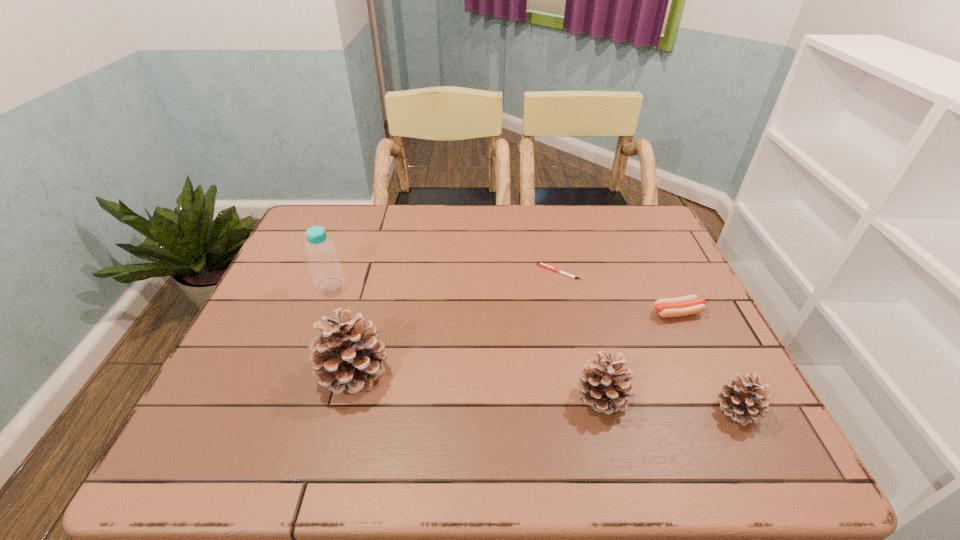
The image size is (960, 540). Identify the location of vacant space that's between the leftmost pinecone and the fourth shortest object. (478, 384).

Where is `blank region between the third shortest object and the third farthest object`? blank region between the third shortest object and the third farthest object is located at coordinates (707, 361).

Where is `free space between the bottle and the second pinecone from right to left`? Image resolution: width=960 pixels, height=540 pixels. free space between the bottle and the second pinecone from right to left is located at coordinates (467, 341).

At what (x,y) coordinates should I click in order to perform the action: click on free point between the third tallest object and the tallest pinecone. Please return your answer as a coordinate pair (x, y). The width and height of the screenshot is (960, 540). Looking at the image, I should click on (478, 384).

Image resolution: width=960 pixels, height=540 pixels. Find the location of `free space between the bottle and the shortest pinecone`. free space between the bottle and the shortest pinecone is located at coordinates (534, 347).

This screenshot has width=960, height=540. I want to click on free space between the leftmost pinecone and the fourth nearest object, so click(516, 342).

Where is `unoccupied position between the second shortest pinecone and the shortest object`? The image size is (960, 540). unoccupied position between the second shortest pinecone and the shortest object is located at coordinates (581, 334).

The image size is (960, 540). What are the coordinates of `free space between the sausage and the second pinecone from left to right` in the screenshot? It's located at (640, 355).

Find the location of `object that is the fourth closest to the bottle`. object that is the fourth closest to the bottle is located at coordinates (687, 305).

Choose which object is the second nearest neighbor to the second pinecone from left to right. Please provide its 2D coordinates. Your answer should be formatted as a tuple, i.e. [(x, y)], where the tuple contains the x and y coordinates of a point satisfying the conditions above.

[(687, 305)]